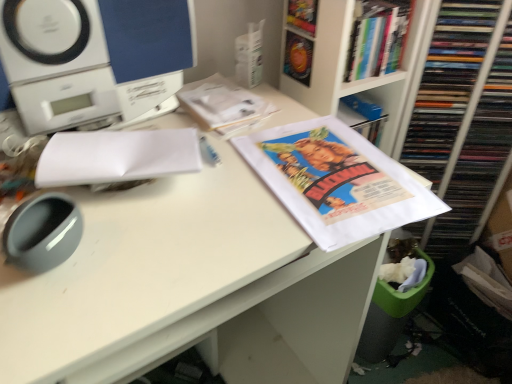
Find the location of a particular element. The image size is (512, 384). vacant space that is in between white paper at left and matte paper poster at center is located at coordinates (221, 210).